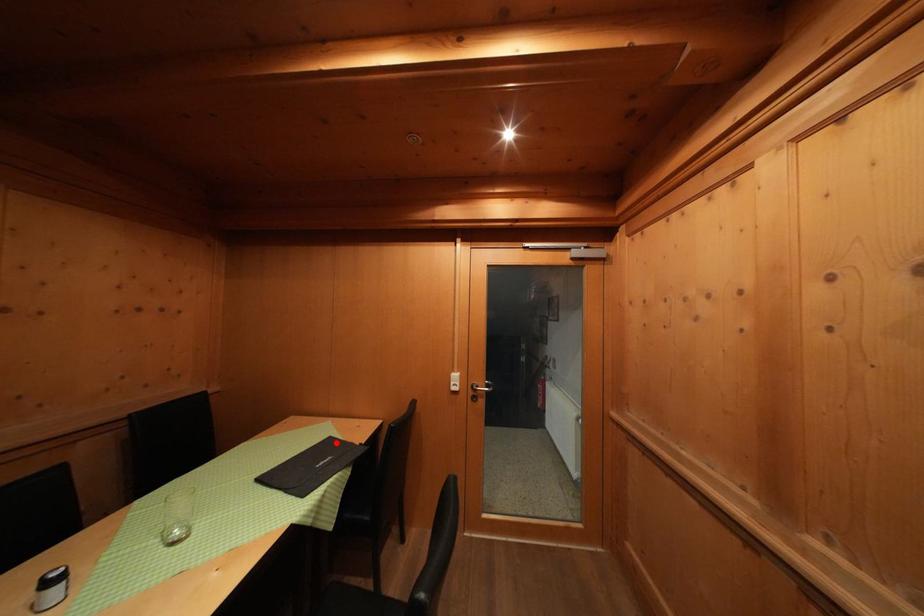
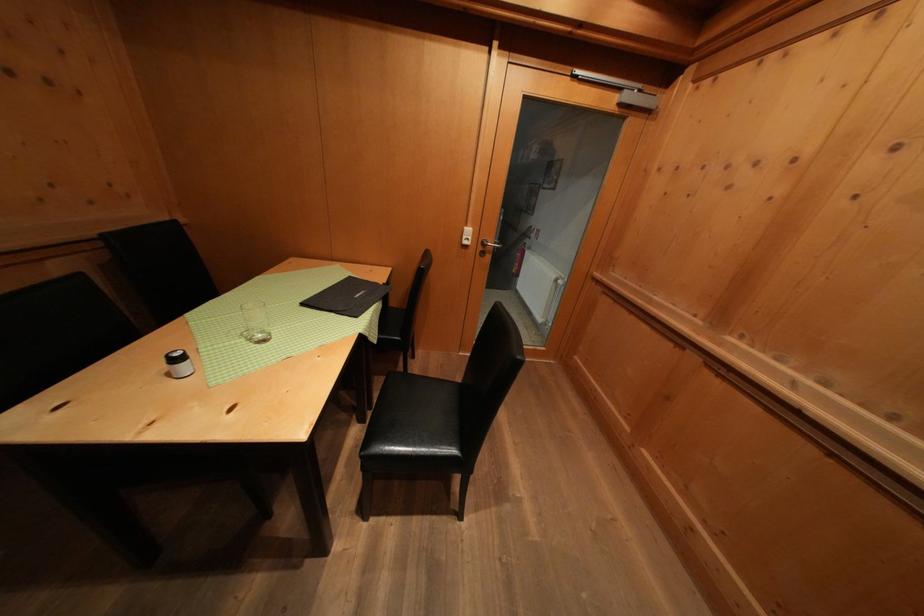
Question: I am providing you with two images of the same scene from different viewpoints. Given a red point in image1, look at the same physical point in image2. Is it:

Choices:
 (A) Closer to the viewpoint
 (B) Farther from the viewpoint

Answer: (A)